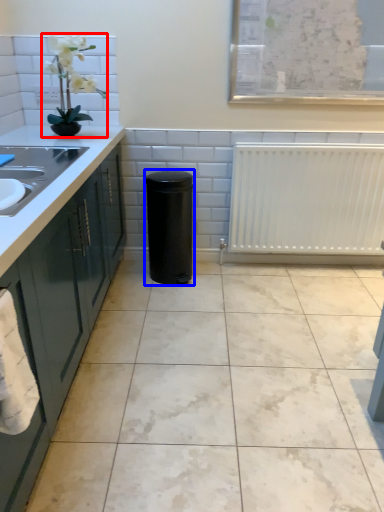
Question: Which point is closer to the camera, houseplant (highlighted by a red box) or appliance (highlighted by a blue box)?

Choices:
 (A) houseplant
 (B) appliance

Answer: (A)